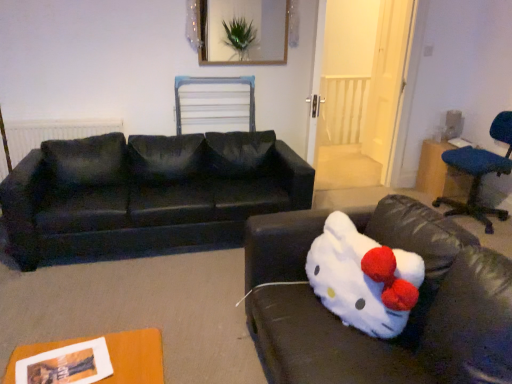
Question: Is matte black radiator at left next to wooden picture frame at upper center and touching it?

Choices:
 (A) yes
 (B) no

Answer: (B)

Question: Is matte black radiator at left closer to camera compared to wooden picture frame at upper center?

Choices:
 (A) no
 (B) yes

Answer: (B)

Question: Is matte black radiator at left not within wooden picture frame at upper center?

Choices:
 (A) no
 (B) yes

Answer: (B)

Question: From the image's perspective, is matte black radiator at left located above wooden picture frame at upper center?

Choices:
 (A) yes
 (B) no

Answer: (B)

Question: Can you confirm if matte black radiator at left is shorter than wooden picture frame at upper center?

Choices:
 (A) yes
 (B) no

Answer: (B)

Question: Considering the relative positions of white plush toy at lower right, the second studio couch in the back-to-front sequence, and blue fabric chair at right in the image provided, is white plush toy at lower right, the second studio couch in the back-to-front sequence, to the left or to the right of blue fabric chair at right?

Choices:
 (A) right
 (B) left

Answer: (B)

Question: From a real-world perspective, is white plush toy at lower right, arranged as the 1th studio couch when viewed from the front, physically located above or below blue fabric chair at right?

Choices:
 (A) below
 (B) above

Answer: (A)

Question: Looking at their shapes, would you say white plush toy at lower right, arranged as the 1th studio couch when viewed from the front, is wider or thinner than blue fabric chair at right?

Choices:
 (A) thin
 (B) wide

Answer: (B)

Question: Looking at the image, does white plush toy at lower right, the second studio couch in the back-to-front sequence, seem bigger or smaller compared to blue fabric chair at right?

Choices:
 (A) big
 (B) small

Answer: (A)

Question: From a real-world perspective, relative to black fabric couch at left, the first studio couch positioned from the back, is wooden picture frame at upper center vertically above or below?

Choices:
 (A) above
 (B) below

Answer: (A)

Question: Is wooden picture frame at upper center inside or outside of black fabric couch at left, the first studio couch positioned from the back?

Choices:
 (A) outside
 (B) inside

Answer: (A)

Question: In terms of size, does wooden picture frame at upper center appear bigger or smaller than black fabric couch at left, the first studio couch positioned from the back?

Choices:
 (A) big
 (B) small

Answer: (B)

Question: Is wooden picture frame at upper center taller or shorter than black fabric couch at left, the first studio couch positioned from the back?

Choices:
 (A) short
 (B) tall

Answer: (A)

Question: From the image's perspective, is black fabric couch at left, the first studio couch positioned from the back, located above or below wooden picture frame at upper center?

Choices:
 (A) above
 (B) below

Answer: (B)

Question: Considering the positions of black fabric couch at left, the second studio couch viewed from the front, and wooden picture frame at upper center in the image, is black fabric couch at left, the second studio couch viewed from the front, taller or shorter than wooden picture frame at upper center?

Choices:
 (A) short
 (B) tall

Answer: (B)